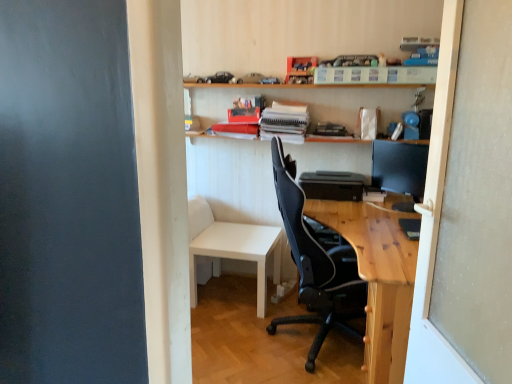
You are a GUI agent. You are given a task and a screenshot of the screen. Output one action in this format:
    pyautogui.click(x=<x>, y=<y>)
    Task: Click on the free space in front of black plastic printer at center
    This screenshot has height=384, width=512.
    Given the screenshot: What is the action you would take?
    pyautogui.click(x=339, y=207)